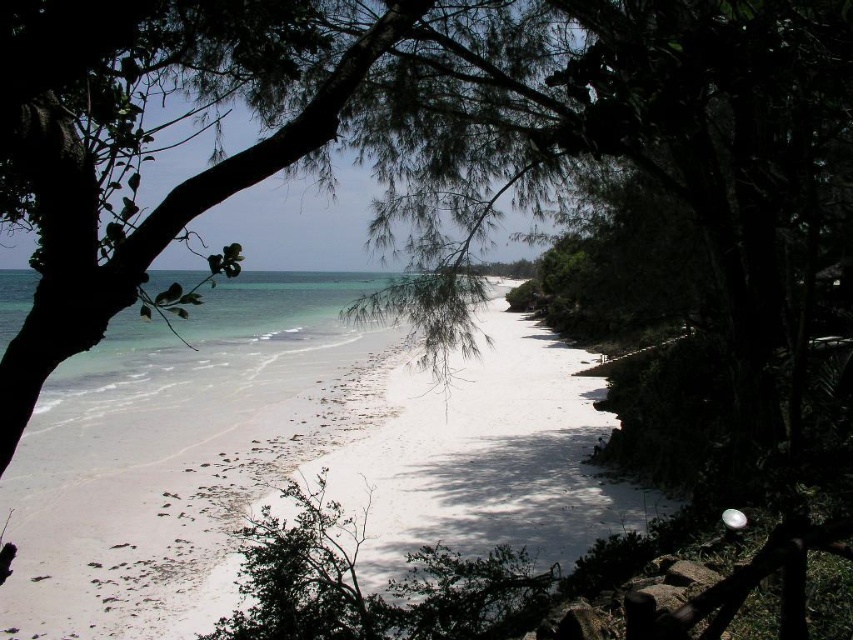
You are standing at the beach and see two points marked on the sand. The first point is labeled as point (165, 541) and the second is point (57, 81). Which point is closer to you?

Point (165, 541) is further to the viewer than point (57, 81), so point (57, 81) is closer to you.

You are standing at the edge of the white sand beach at center and want to walk towards the green leafy tree at center. Which direction should you move to get closer to the tree?

The green leafy tree at center is further away from you than the white sand beach at center, so you should move forward towards the tree to get closer.